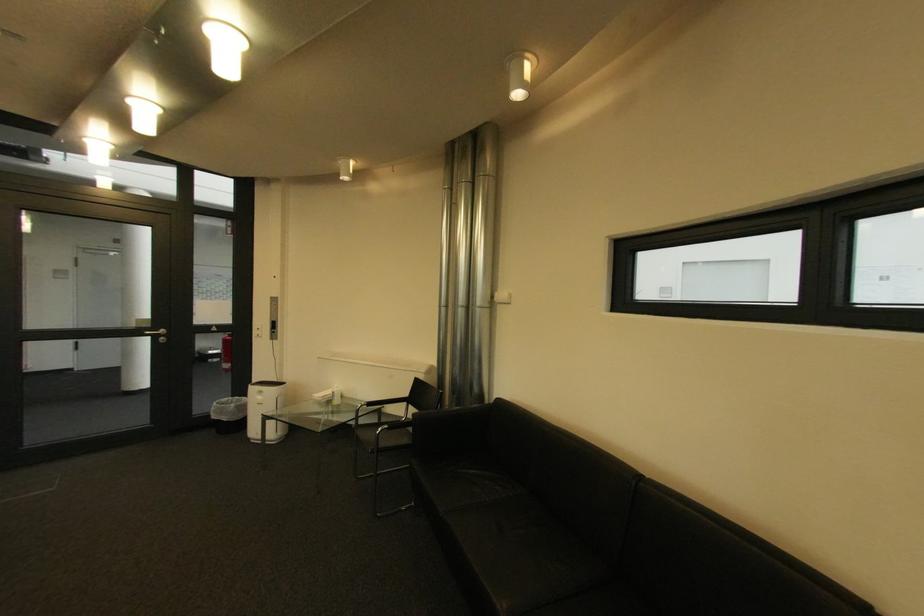
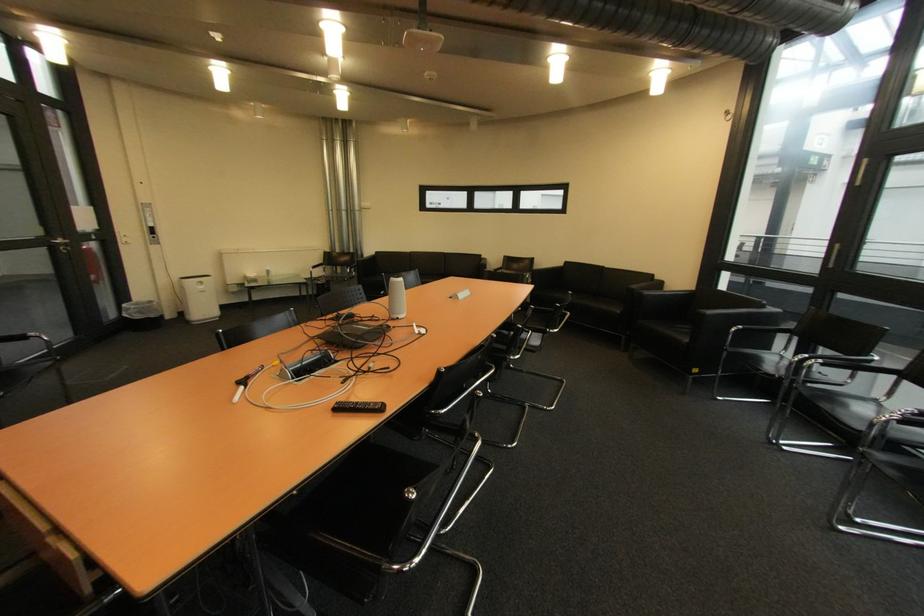
The point at (x=171, y=331) is marked in the first image. Where is the corresponding point in the second image?

(68, 241)